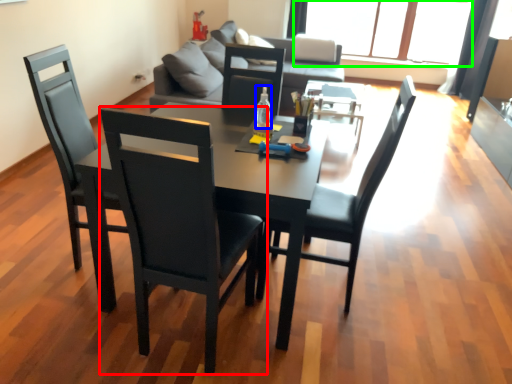
Question: Estimate the real-world distances between objects in this image. Which object is closer to chair (highlighted by a red box), bottle (highlighted by a blue box) or window (highlighted by a green box)?

Choices:
 (A) bottle
 (B) window

Answer: (A)